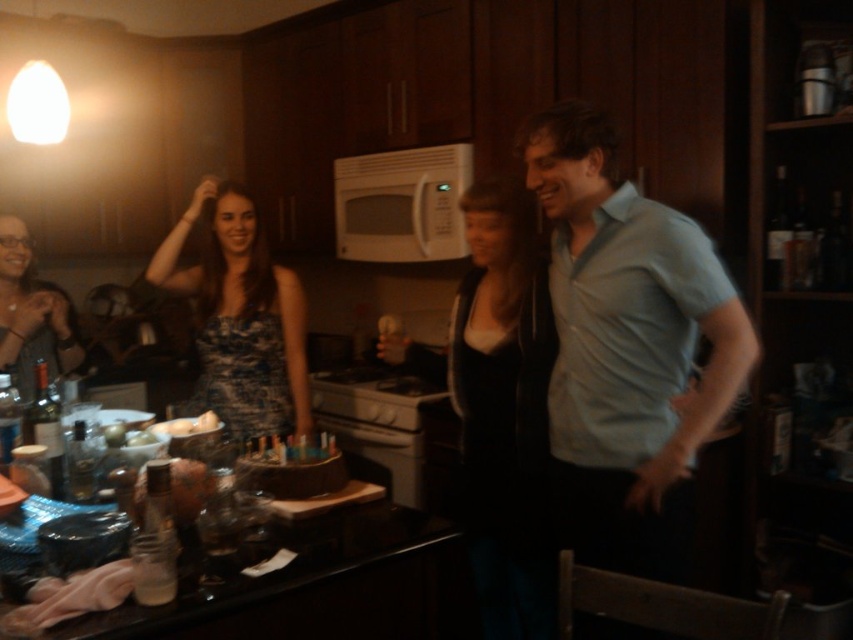
You are at a birthday party in a kitchen and see two guests dressed in light blue cotton shirt at right and blue printed dress at center. Which guest is positioned more to the right side of the room?

The light blue cotton shirt at right is positioned more to the right side of the room compared to the blue printed dress at center.

You are a photographer taking a picture of the light blue cotton shirt at right and the blue printed dress at center. Which one should you focus on first to ensure both are in focus?

The light blue cotton shirt at right is in front of the blue printed dress at center, so you should focus on the light blue cotton shirt at right first to ensure both are in focus.